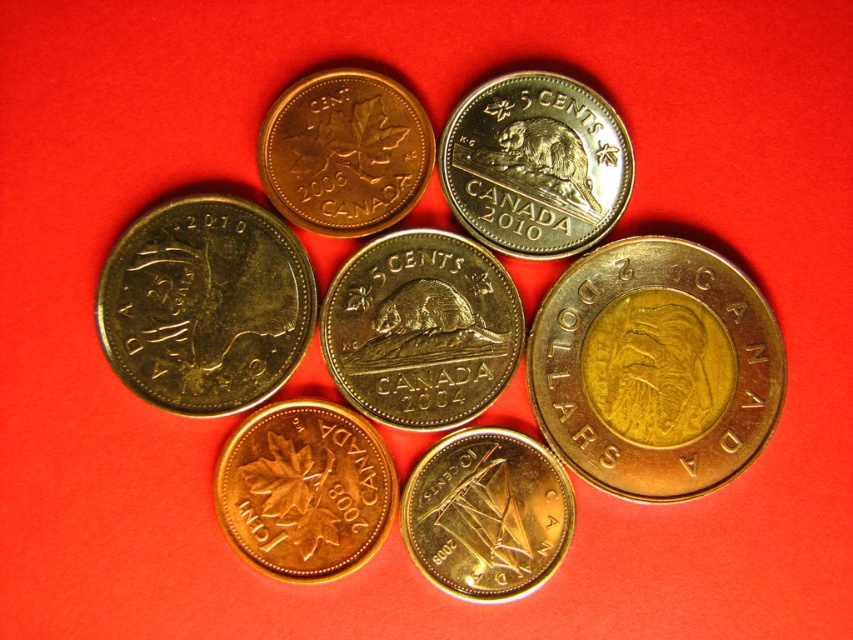
Question: Which object appears farthest from the camera in this image?

Choices:
 (A) gold-plated sailboat at center
 (B) gold plated maple leaf at center
 (C) gold plated eagle at center
 (D) gold plated coin at center

Answer: (B)

Question: Which point is farther to the camera?

Choices:
 (A) (605, 256)
 (B) (264, 333)

Answer: (A)

Question: Which object is positioned closest to the silver/golden metallic beaver at center?

Choices:
 (A) gold plated beaver at center
 (B) gold plated eagle at center
 (C) brass/bronze maple leaf at center

Answer: (A)

Question: Does gold plated eagle at center have a larger size compared to gold plated maple leaf at center?

Choices:
 (A) no
 (B) yes

Answer: (B)

Question: Does gold plated coin at center have a smaller size compared to silver/golden metallic beaver at center?

Choices:
 (A) no
 (B) yes

Answer: (A)

Question: Can you confirm if gold plated coin at center is positioned to the right of gold plated maple leaf at center?

Choices:
 (A) no
 (B) yes

Answer: (A)